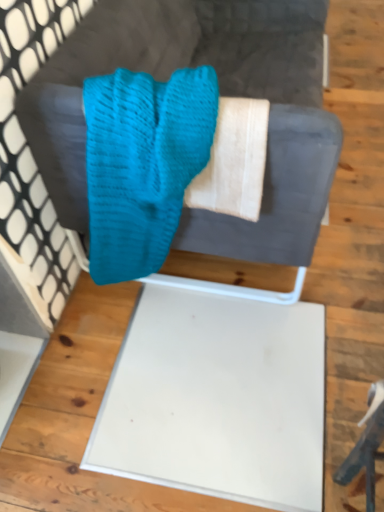
Find the location of `knitted teal sweater at upper center`. knitted teal sweater at upper center is located at coordinates (221, 93).

This screenshot has width=384, height=512. Describe the element at coordinates (221, 93) in the screenshot. I see `knitted teal sweater at upper center` at that location.

Locate an element on the screen. The image size is (384, 512). teal knitted scrub at center is located at coordinates (143, 164).

The image size is (384, 512). Describe the element at coordinates (143, 164) in the screenshot. I see `teal knitted scrub at center` at that location.

Identify the location of knitted teal sweater at upper center. Image resolution: width=384 pixels, height=512 pixels. (221, 93).

Which object is positioned more to the left, teal knitted scrub at center or knitted teal sweater at upper center?

teal knitted scrub at center is more to the left.

Is teal knitted scrub at center in front of or behind knitted teal sweater at upper center in the image?

In the image, teal knitted scrub at center appears in front of knitted teal sweater at upper center.

Is point (95, 79) in front of point (35, 151)?

Yes, it is.

From the image's perspective, is teal knitted scrub at center under knitted teal sweater at upper center?

Correct, teal knitted scrub at center appears lower than knitted teal sweater at upper center in the image.

From a real-world perspective, relative to knitted teal sweater at upper center, is teal knitted scrub at center vertically above or below?

In terms of real-world spatial position, teal knitted scrub at center is above knitted teal sweater at upper center.

Looking at this image, can you confirm if teal knitted scrub at center is wider than knitted teal sweater at upper center?

No.

Who is taller, teal knitted scrub at center or knitted teal sweater at upper center?

knitted teal sweater at upper center.

Which of these two, teal knitted scrub at center or knitted teal sweater at upper center, is smaller?

Smaller between the two is teal knitted scrub at center.

Is teal knitted scrub at center positioned beyond the bounds of knitted teal sweater at upper center?

No.

Is teal knitted scrub at center next to knitted teal sweater at upper center and touching it?

teal knitted scrub at center and knitted teal sweater at upper center are clearly separated.

Could you tell me if teal knitted scrub at center is turned towards knitted teal sweater at upper center?

Yes, teal knitted scrub at center is aimed at knitted teal sweater at upper center.

How far apart are teal knitted scrub at center and knitted teal sweater at upper center?

14.57 inches.

The height and width of the screenshot is (512, 384). What are the coordinates of `furniture above the teal knitted scrub at center (from the image's perspective)` in the screenshot? It's located at (221, 93).

Which object is positioned more to the left, knitted teal sweater at upper center or teal knitted scrub at center?

teal knitted scrub at center.

Between knitted teal sweater at upper center and teal knitted scrub at center, which one is positioned in front?

teal knitted scrub at center is in front.

Considering the positions of point (191, 30) and point (135, 78), is point (191, 30) closer or farther from the camera than point (135, 78)?

Clearly, point (191, 30) is more distant from the camera than point (135, 78).

From the image's perspective, which is above, knitted teal sweater at upper center or teal knitted scrub at center?

knitted teal sweater at upper center.

From a real-world perspective, which is physically above, knitted teal sweater at upper center or teal knitted scrub at center?

teal knitted scrub at center, from a real-world perspective.

Considering the sizes of objects knitted teal sweater at upper center and teal knitted scrub at center in the image provided, who is wider, knitted teal sweater at upper center or teal knitted scrub at center?

With larger width is knitted teal sweater at upper center.

Which of these two, knitted teal sweater at upper center or teal knitted scrub at center, stands taller?

With more height is knitted teal sweater at upper center.

Based on the photo, who is bigger, knitted teal sweater at upper center or teal knitted scrub at center?

Bigger between the two is knitted teal sweater at upper center.

Which is correct: knitted teal sweater at upper center is inside teal knitted scrub at center, or outside of it?

knitted teal sweater at upper center lies outside teal knitted scrub at center.

Consider the image. Is knitted teal sweater at upper center placed right next to teal knitted scrub at center?

No, knitted teal sweater at upper center is not making contact with teal knitted scrub at center.

Is knitted teal sweater at upper center looking in the opposite direction of teal knitted scrub at center?

No.

In the scene shown: How different are the orientations of knitted teal sweater at upper center and teal knitted scrub at center in degrees?

The angle between the facing direction of knitted teal sweater at upper center and the facing direction of teal knitted scrub at center is 90.5 degrees.

Measure the distance from knitted teal sweater at upper center to teal knitted scrub at center.

knitted teal sweater at upper center is 37.01 centimeters away from teal knitted scrub at center.

Where is `furniture that is on the right side of teal knitted scrub at center`? The image size is (384, 512). furniture that is on the right side of teal knitted scrub at center is located at coordinates (221, 93).

The height and width of the screenshot is (512, 384). I want to click on furniture on the right of teal knitted scrub at center, so click(x=221, y=93).

You are a GUI agent. You are given a task and a screenshot of the screen. Output one action in this format:
    pyautogui.click(x=<x>, y=<y>)
    Task: Click on the scrub on the left of knitted teal sweater at upper center
    This screenshot has width=384, height=512.
    Given the screenshot: What is the action you would take?
    pyautogui.click(x=143, y=164)